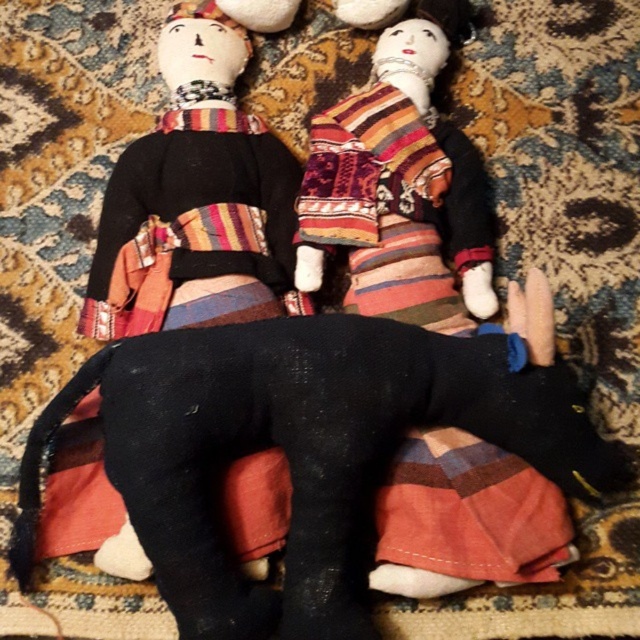
Question: Which point appears farthest from the camera in this image?

Choices:
 (A) (250, 118)
 (B) (108, 449)

Answer: (A)

Question: Can you confirm if matte black doll at left is thinner than textured multicolored fabric rag doll at center?

Choices:
 (A) yes
 (B) no

Answer: (B)

Question: Can you confirm if black fabric dog at center is thinner than textured multicolored fabric rag doll at center?

Choices:
 (A) no
 (B) yes

Answer: (A)

Question: Which object appears closest to the camera in this image?

Choices:
 (A) matte black doll at left
 (B) textured multicolored fabric rag doll at center

Answer: (A)

Question: Which point is farther from the camera taking this photo?

Choices:
 (A) (180, 321)
 (B) (340, 10)
 (C) (529, 282)

Answer: (B)

Question: Is black fabric dog at center positioned at the back of matte black doll at left?

Choices:
 (A) yes
 (B) no

Answer: (B)